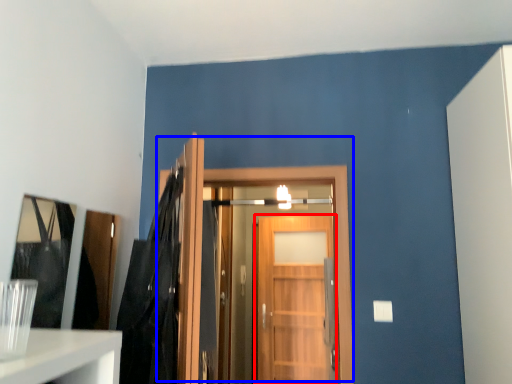
Question: Among these objects, which one is nearest to the camera, door (highlighted by a red box) or door (highlighted by a blue box)?

Choices:
 (A) door
 (B) door

Answer: (B)